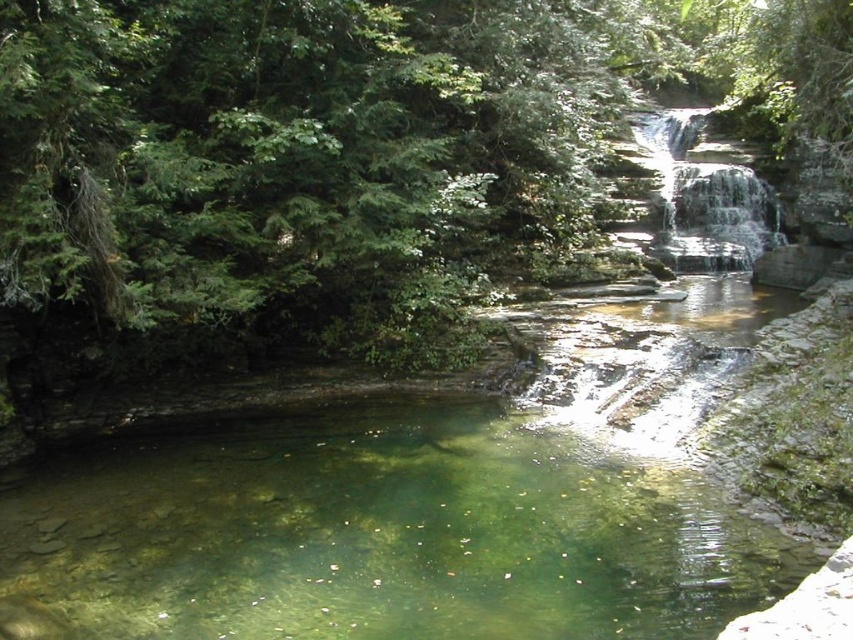
Does clear water at center appear on the left side of clear stone waterfall at upper center?

Correct, you'll find clear water at center to the left of clear stone waterfall at upper center.

Looking at this image, is clear water at center below clear stone waterfall at upper center?

Yes.

Which is in front, point (297, 564) or point (697, 164)?

Point (297, 564) is in front.

The height and width of the screenshot is (640, 853). I want to click on clear water at center, so (383, 532).